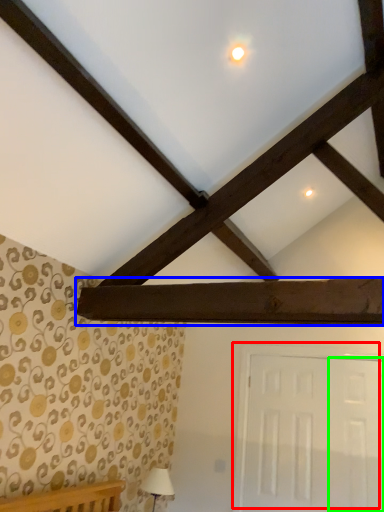
Question: Considering the real-world distances, which object is closest to door (highlighted by a red box)? plank (highlighted by a blue box) or door (highlighted by a green box).

Choices:
 (A) plank
 (B) door

Answer: (B)